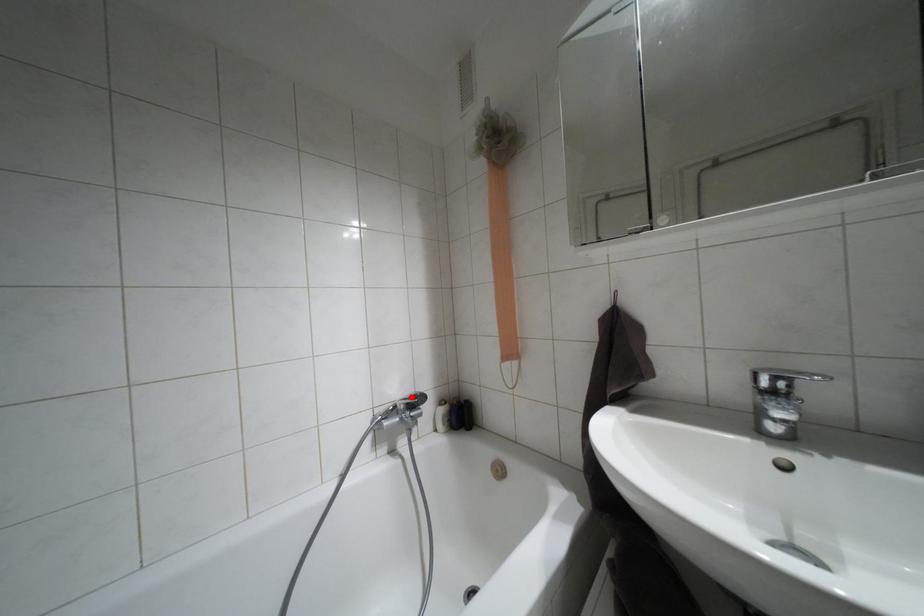
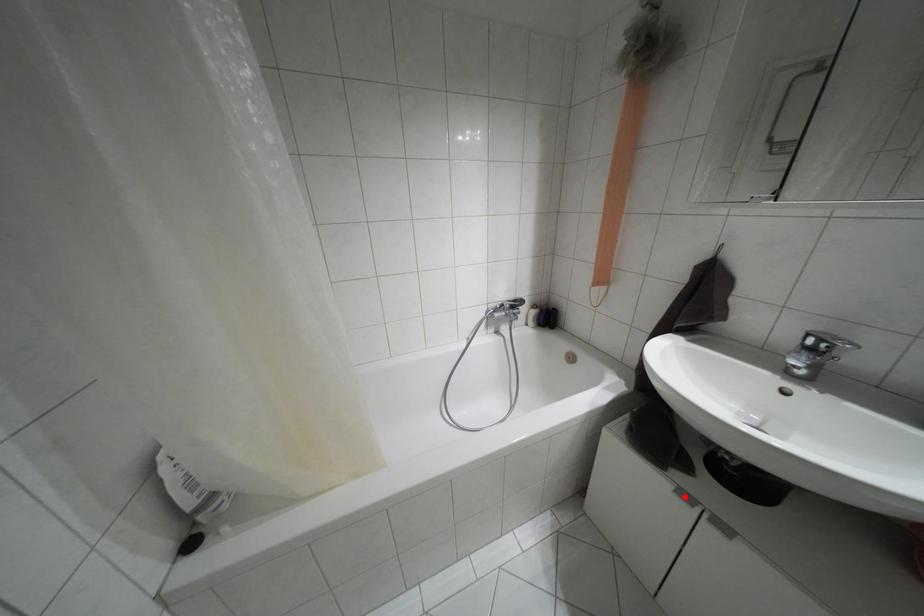
I am providing you with two images of the same scene from different viewpoints. A red point is marked on the first image and another point is marked on the second image. Is the red point in image1 aligned with the point shown in image2?

No